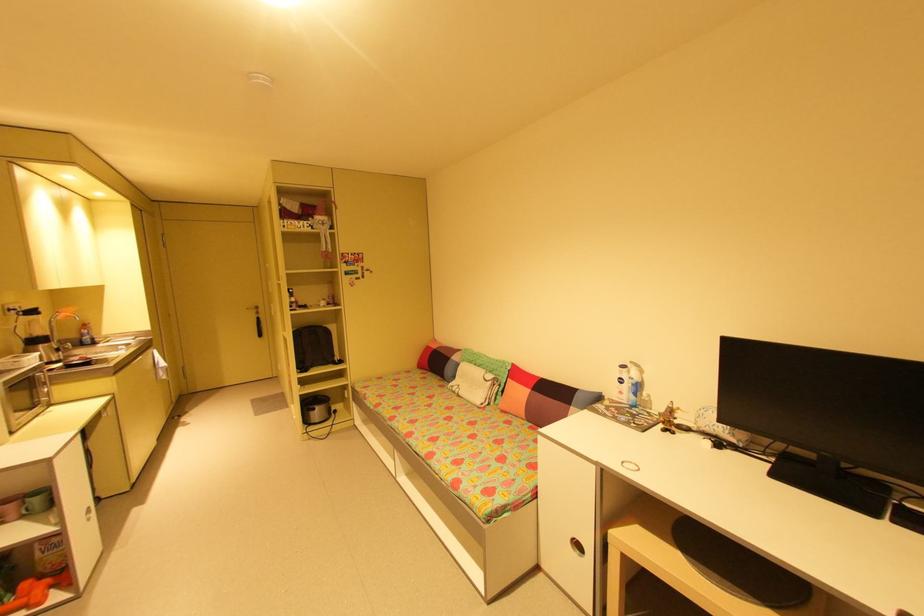
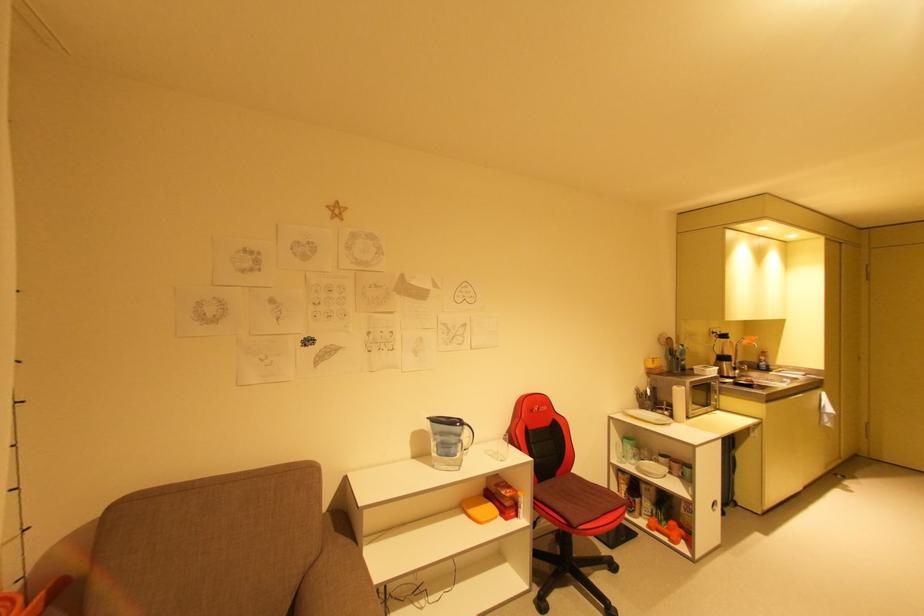
Question: Based on the continuous images, in which direction is the camera rotating? Reply with the corresponding letter.

Choices:
 (A) Left
 (B) Right
 (C) Up
 (D) Down

Answer: (A)